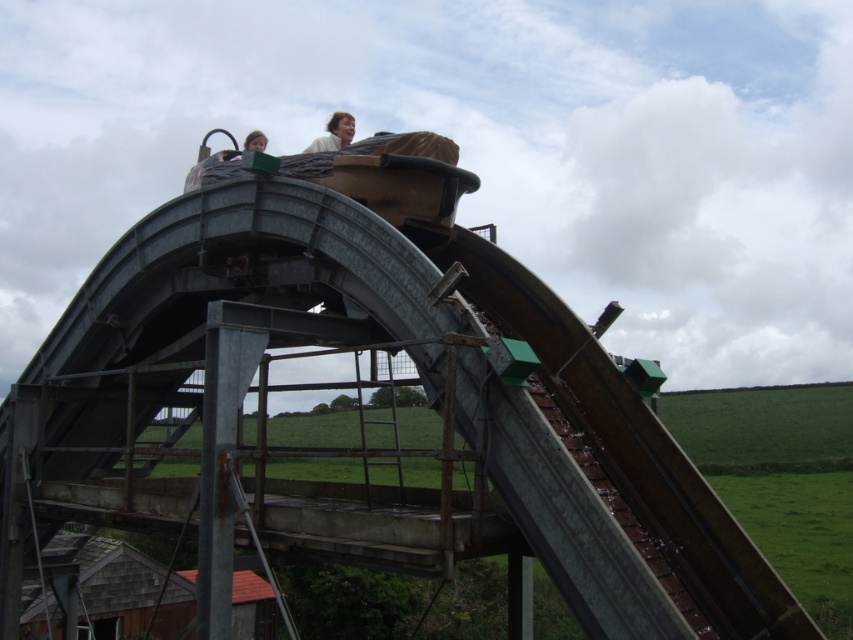
Question: Which object appears farthest from the camera in this image?

Choices:
 (A) matte black helmet at upper center
 (B) light brown hair at upper center

Answer: (A)

Question: Is light brown hair at upper center positioned behind matte black helmet at upper center?

Choices:
 (A) yes
 (B) no

Answer: (B)

Question: Is light brown hair at upper center further to camera compared to matte black helmet at upper center?

Choices:
 (A) no
 (B) yes

Answer: (A)

Question: Which point is closer to the camera taking this photo?

Choices:
 (A) (341, 138)
 (B) (224, 156)

Answer: (B)

Question: Does light brown hair at upper center come behind matte black helmet at upper center?

Choices:
 (A) yes
 (B) no

Answer: (B)